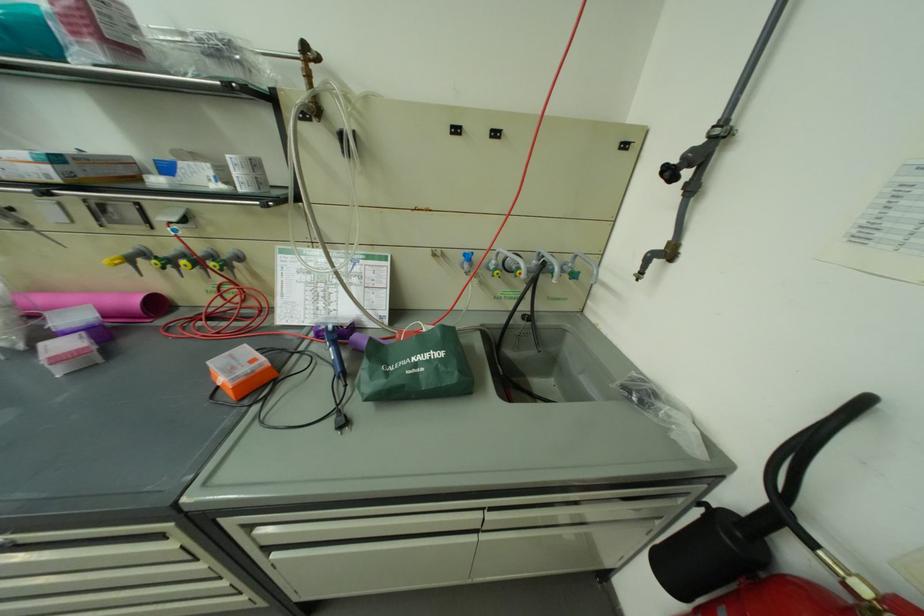
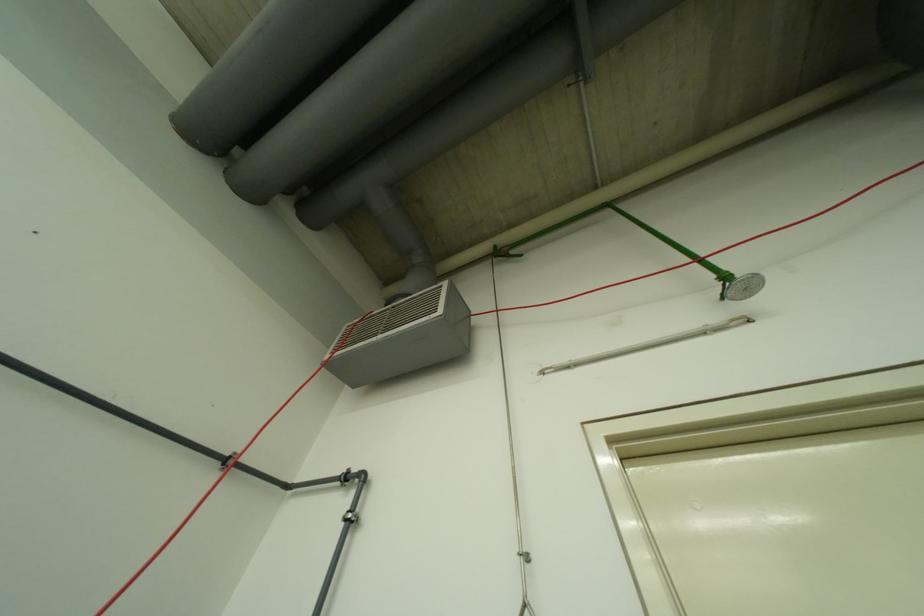
The first image is from the beginning of the video and the second image is from the end. How did the camera likely rotate when shooting the video?

The camera's rotation is toward right-up.